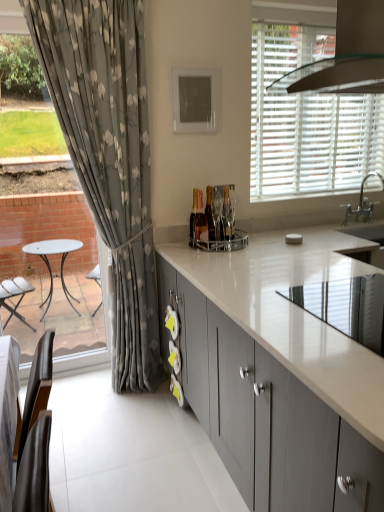
Question: Is white matte blinds at upper right inside or outside of matte gray cabinets at center?

Choices:
 (A) outside
 (B) inside

Answer: (A)

Question: Considering the positions of white matte blinds at upper right and matte gray cabinets at center in the image, is white matte blinds at upper right wider or thinner than matte gray cabinets at center?

Choices:
 (A) thin
 (B) wide

Answer: (A)

Question: Based on their relative distances, which object is farther from the white glossy countertop at center?

Choices:
 (A) clear glass exhaust hood at upper right
 (B) matte gray cabinets at center
 (C) fluffy gray curtain at left
 (D) white glossy sink at upper right
 (E) white matte blinds at upper right

Answer: (A)

Question: Which object is positioned farthest from the white glossy sink at upper right?

Choices:
 (A) white matte blinds at upper right
 (B) fluffy gray curtain at left
 (C) matte gray cabinets at center
 (D) clear glass exhaust hood at upper right
 (E) white glossy countertop at center

Answer: (B)